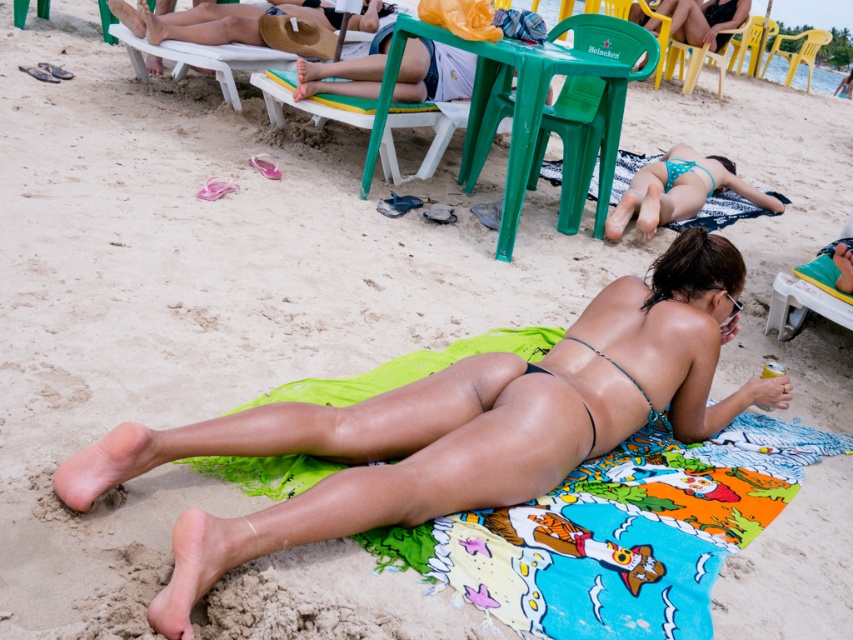
You are standing at the camera position and want to throw a beach ball to someone. You have two options for where to throw it. The first is to the location marked by point [370,67] and the second is to point [804,45]. Which point should you aim for if you want the ball to travel a shorter distance?

Point [370,67] is closer to the camera than point [804,45], so you should aim for point [370,67] to minimize the distance the ball has to travel.

You are standing at the beach and want to grab a drink from the table next to the green plastic beach chair at center. However, you need to walk past the yellow plastic chair at upper right. Which chair should you avoid stepping on to reach the table?

You should avoid stepping on the yellow plastic chair at upper right because the green plastic beach chair at center is closer to you, so the path to the table is near the green chair.

You are a photographer standing at the beach and want to take a photo that includes both the yellow plastic chair at upper right and the green string bikini top at center. Which object should you adjust your camera focus to first to ensure both are in the frame?

The yellow plastic chair at upper right is further to the viewer than the green string bikini top at center, so you should focus on the yellow plastic chair at upper right first to ensure both are in the frame.